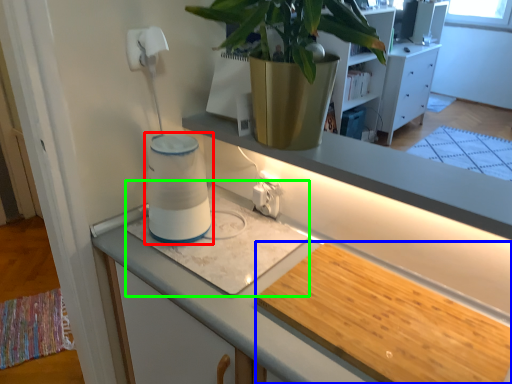
Question: Estimate the real-world distances between objects in this image. Which object is closer to water heater (highlighted by a red box), wide (highlighted by a blue box) or wide (highlighted by a green box)?

Choices:
 (A) wide
 (B) wide

Answer: (B)